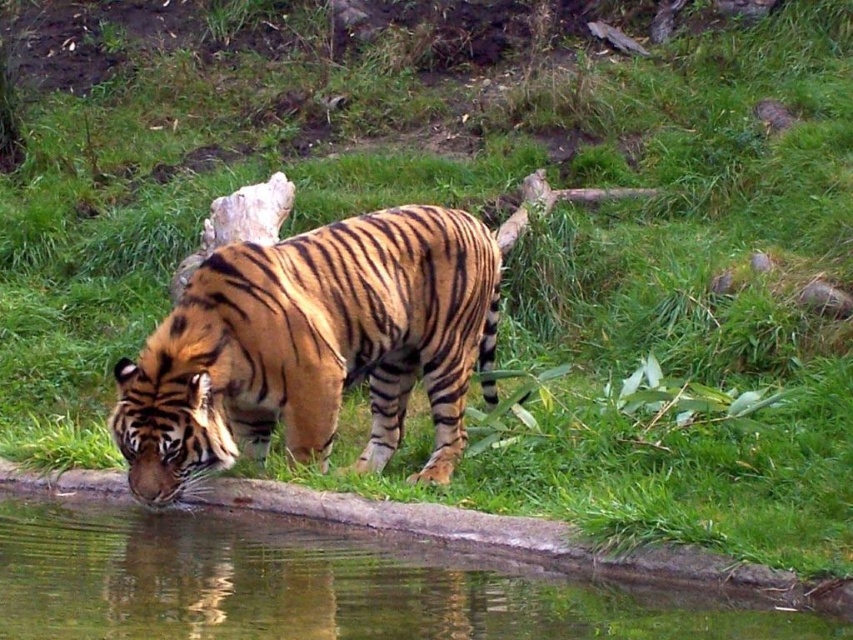
In the scene shown: Can you confirm if orange-brown striped tiger at center is positioned to the right of clear water at pond center?

In fact, orange-brown striped tiger at center is to the left of clear water at pond center.

Can you confirm if orange-brown striped tiger at center is positioned below clear water at pond center?

Incorrect, orange-brown striped tiger at center is not positioned below clear water at pond center.

Which is in front, point (445, 252) or point (44, 570)?

Point (44, 570) is in front.

I want to click on orange-brown striped tiger at center, so click(x=312, y=346).